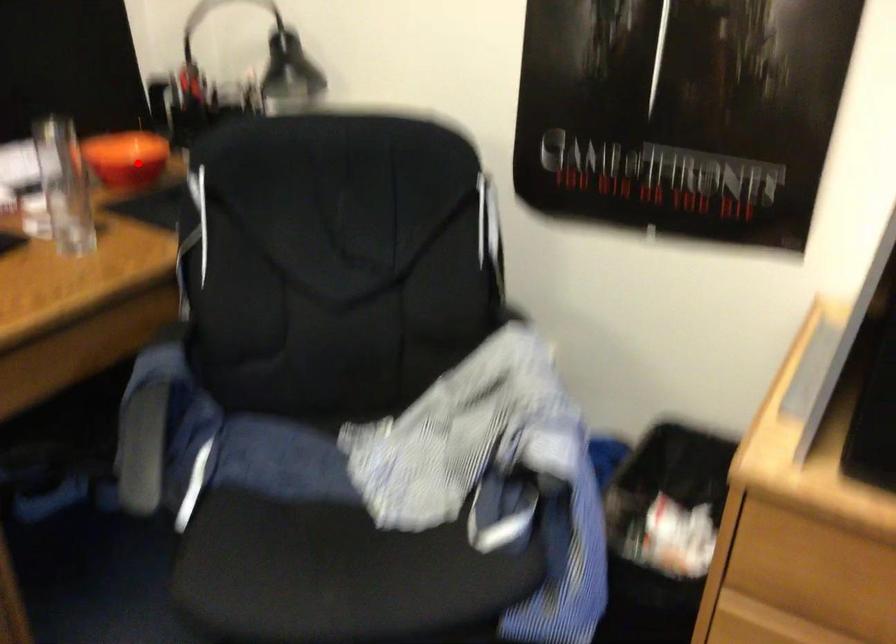
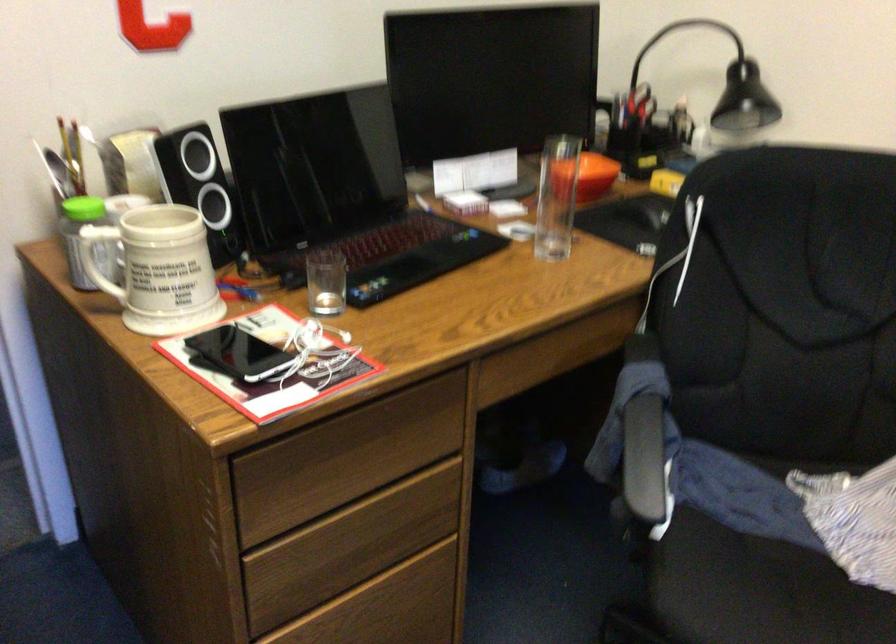
Where in the second image is the point corresponding to the highlighted location from the first image?

(590, 176)